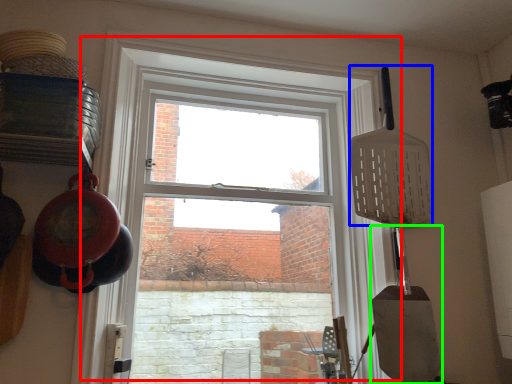
Question: Which is farther away from window (highlighted by a red box)? spatula (highlighted by a blue box) or shovel (highlighted by a green box)?

Choices:
 (A) spatula
 (B) shovel

Answer: (B)